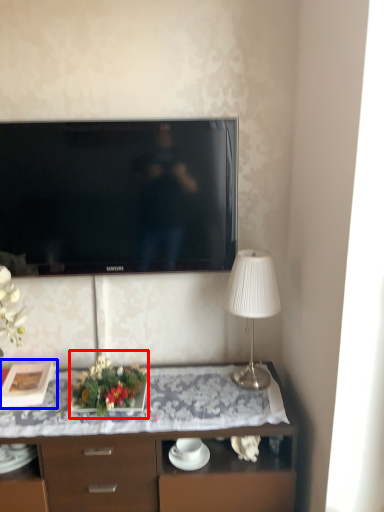
Question: Which of the following is the closest to the observer, floral arrangement (highlighted by a red box) or picture frame (highlighted by a blue box)?

Choices:
 (A) floral arrangement
 (B) picture frame

Answer: (A)